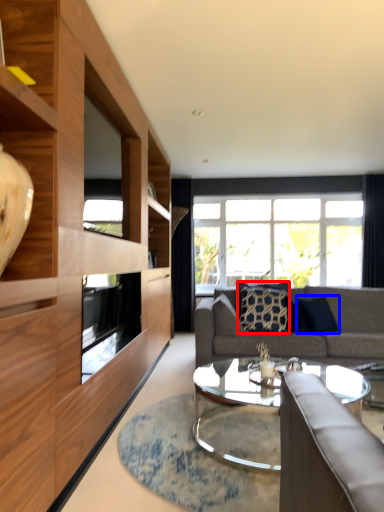
Question: Among these objects, which one is farthest to the camera, pillow (highlighted by a red box) or pillow (highlighted by a blue box)?

Choices:
 (A) pillow
 (B) pillow

Answer: (A)